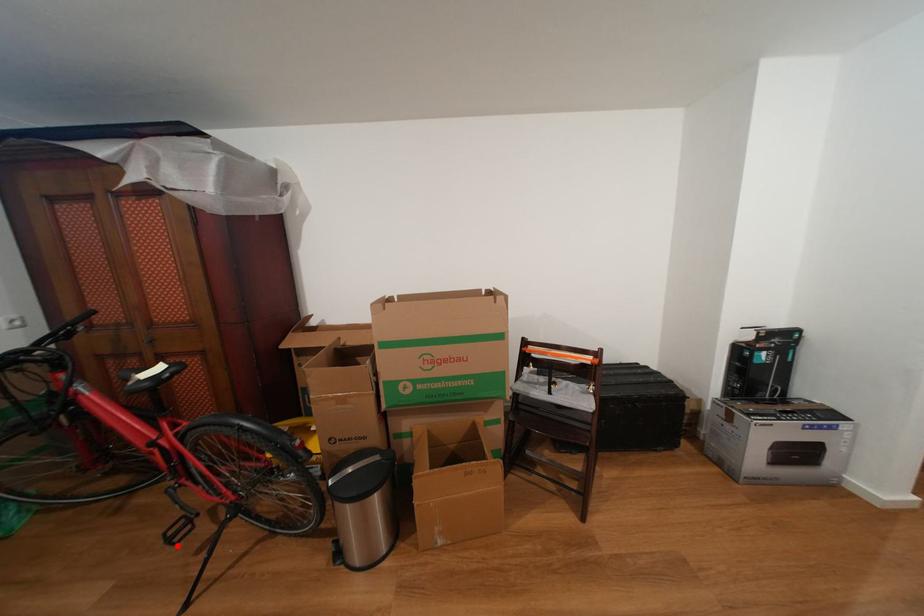
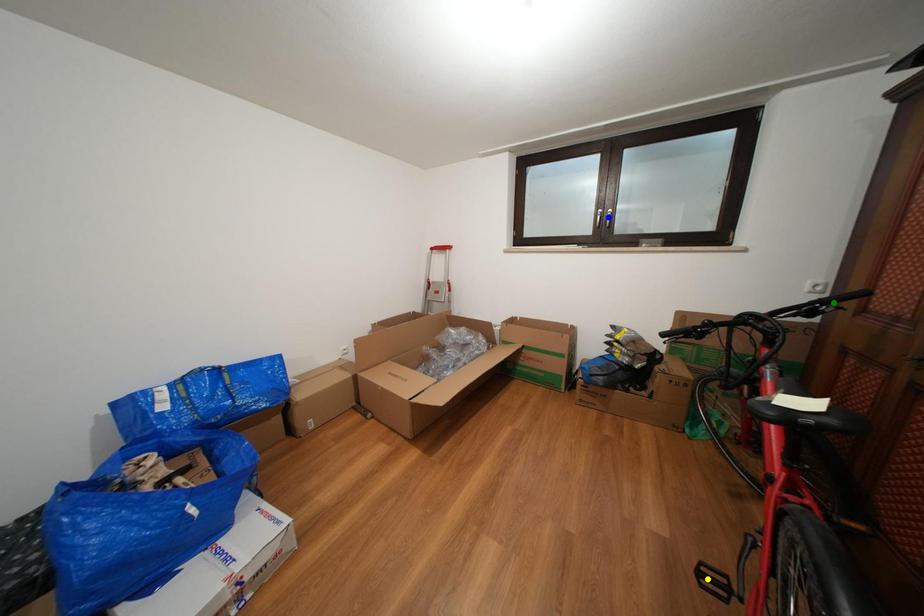
Question: I am providing you with two images of the same scene from different viewpoints. A red point is marked on the first image. You are given multiple points on the second image. Can you choose the point in image 2 that corresponds to the point in image 1?

Choices:
 (A) blue point
 (B) yellow point
 (C) green point

Answer: (B)